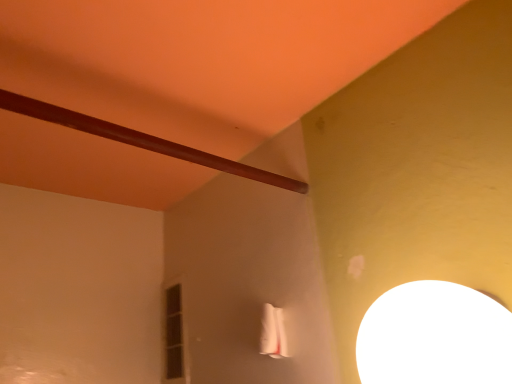
Question: From their relative heights in the image, would you say white glossy lampshade at upper right is taller or shorter than matte glass window at center left?

Choices:
 (A) short
 (B) tall

Answer: (A)

Question: Is point (440, 359) closer or farther from the camera than point (172, 309)?

Choices:
 (A) closer
 (B) farther

Answer: (A)

Question: Estimate the real-world distances between objects in this image. Which object is farther from the white glossy lampshade at upper right?

Choices:
 (A) brown polished wood beam at upper left
 (B) matte glass window at center left

Answer: (B)

Question: Which object is the closest to the matte glass window at center left?

Choices:
 (A) white glossy lampshade at upper right
 (B) brown polished wood beam at upper left

Answer: (B)